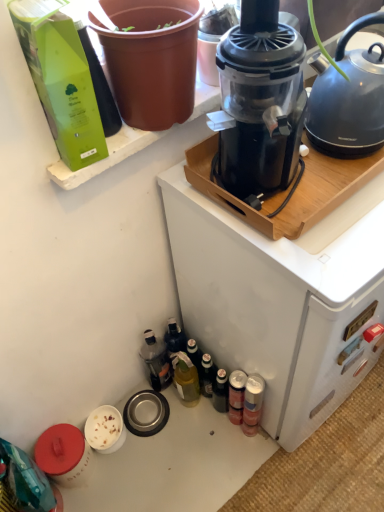
Question: Is metallic silver can at lower right, arranged as the first bottle when viewed from the right, beside metallic silver can at lower right, which ranks as the third bottle in left-to-right order?

Choices:
 (A) yes
 (B) no

Answer: (A)

Question: From the image's perspective, is metallic silver can at lower right, arranged as the first bottle when viewed from the right, under metallic silver can at lower right, which ranks as the third bottle in left-to-right order?

Choices:
 (A) yes
 (B) no

Answer: (A)

Question: Is metallic silver can at lower right, which is the 4th bottle in left-to-right order, at the right side of metallic silver can at lower right, the 2th bottle in the right-to-left sequence?

Choices:
 (A) no
 (B) yes

Answer: (B)

Question: Would you say metallic silver can at lower right, arranged as the first bottle when viewed from the right, is a long distance from metallic silver can at lower right, which ranks as the third bottle in left-to-right order?

Choices:
 (A) yes
 (B) no

Answer: (B)

Question: Is metallic silver can at lower right, which is the 4th bottle in left-to-right order, looking in the opposite direction of metallic silver can at lower right, the 2th bottle in the right-to-left sequence?

Choices:
 (A) no
 (B) yes

Answer: (B)

Question: In terms of height, does green glass bottle at lower center, which is counted as the 2th bottle, starting from the left, look taller or shorter compared to translucent plastic bottle at lower left, the 1th bottle in the left-to-right sequence?

Choices:
 (A) tall
 (B) short

Answer: (A)

Question: From a real-world perspective, relative to translucent plastic bottle at lower left, the 1th bottle in the left-to-right sequence, is green glass bottle at lower center, which is counted as the 3th bottle, starting from the right, vertically above or below?

Choices:
 (A) below
 (B) above

Answer: (A)

Question: Considering the positions of green glass bottle at lower center, which is counted as the 2th bottle, starting from the left, and translucent plastic bottle at lower left, the 1th bottle in the left-to-right sequence, in the image, is green glass bottle at lower center, which is counted as the 2th bottle, starting from the left, wider or thinner than translucent plastic bottle at lower left, the 1th bottle in the left-to-right sequence,?

Choices:
 (A) wide
 (B) thin

Answer: (B)

Question: Considering their positions, is green glass bottle at lower center, which is counted as the 3th bottle, starting from the right, located in front of or behind translucent plastic bottle at lower left, the 1th bottle in the left-to-right sequence?

Choices:
 (A) behind
 (B) front

Answer: (B)

Question: Considering the positions of point (185, 61) and point (241, 264), is point (185, 61) closer or farther from the camera than point (241, 264)?

Choices:
 (A) closer
 (B) farther

Answer: (A)

Question: From the image's perspective, is brown matte flowerpot at upper left located above or below black plastic coffee maker at upper center?

Choices:
 (A) below
 (B) above

Answer: (B)

Question: Would you say brown matte flowerpot at upper left is inside or outside black plastic coffee maker at upper center?

Choices:
 (A) inside
 (B) outside

Answer: (B)

Question: Considering the positions of brown matte flowerpot at upper left and black plastic coffee maker at upper center in the image, is brown matte flowerpot at upper left bigger or smaller than black plastic coffee maker at upper center?

Choices:
 (A) small
 (B) big

Answer: (A)

Question: Considering the positions of point (312, 345) and point (294, 136), is point (312, 345) closer or farther from the camera than point (294, 136)?

Choices:
 (A) farther
 (B) closer

Answer: (A)

Question: In terms of width, does black plastic coffee maker at upper center look wider or thinner when compared to transparent plastic juicer at upper center?

Choices:
 (A) thin
 (B) wide

Answer: (B)